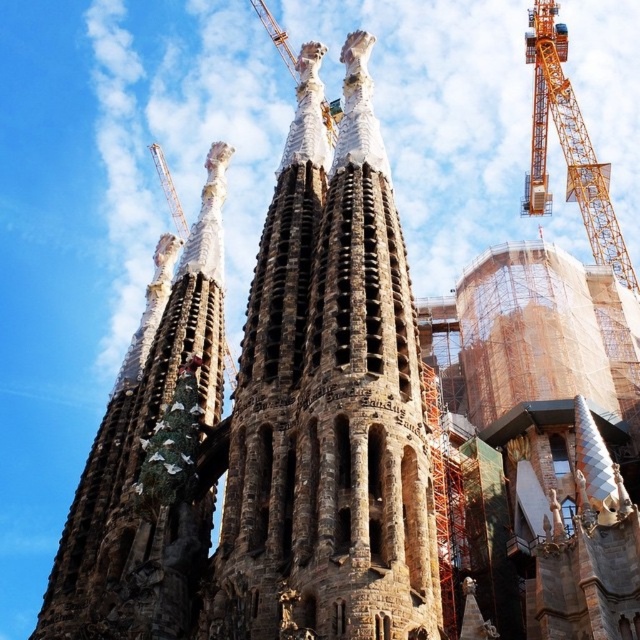
Does brown stone tower at center have a greater width compared to orange metallic crane at upper left?

No.

Where is `brown stone tower at center`? brown stone tower at center is located at coordinates (328, 400).

Does point (532, 68) come in front of point (163, 180)?

No, (532, 68) is further to viewer.

Can you confirm if yellow metallic crane at upper right is positioned to the left of orange metallic crane at upper left?

In fact, yellow metallic crane at upper right is to the right of orange metallic crane at upper left.

Does point (532, 193) come behind point (177, 198)?

No, it is not.

You are a GUI agent. You are given a task and a screenshot of the screen. Output one action in this format:
    pyautogui.click(x=<x>, y=<y>)
    Task: Click on the yellow metallic crane at upper right
    The image size is (640, 640).
    Given the screenshot: What is the action you would take?
    pyautogui.click(x=568, y=145)

Image resolution: width=640 pixels, height=640 pixels. Describe the element at coordinates (141, 452) in the screenshot. I see `brown stone tower at left` at that location.

Does point (138, 616) lie behind point (538, 208)?

No, (138, 616) is in front of (538, 208).

This screenshot has height=640, width=640. Identify the location of brown stone tower at left. (141, 452).